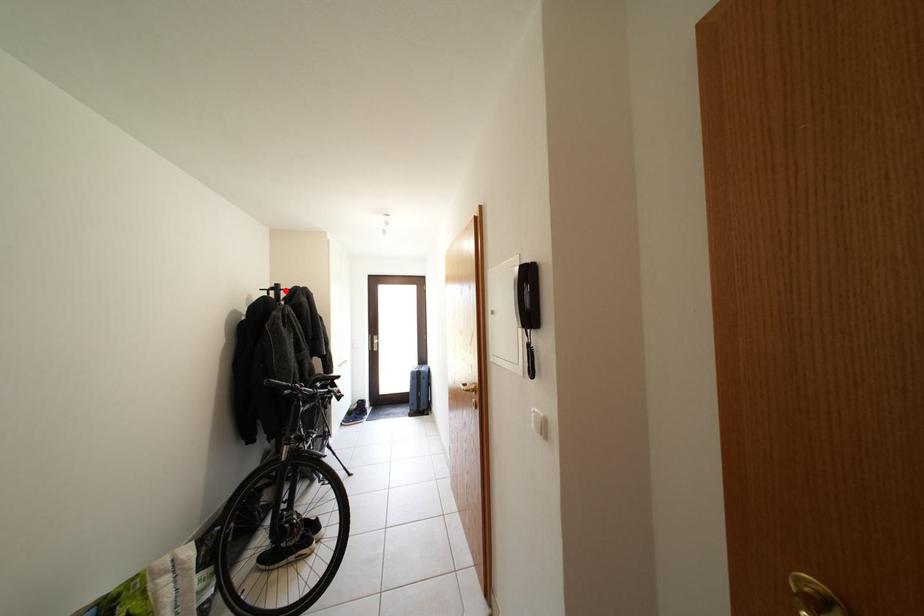
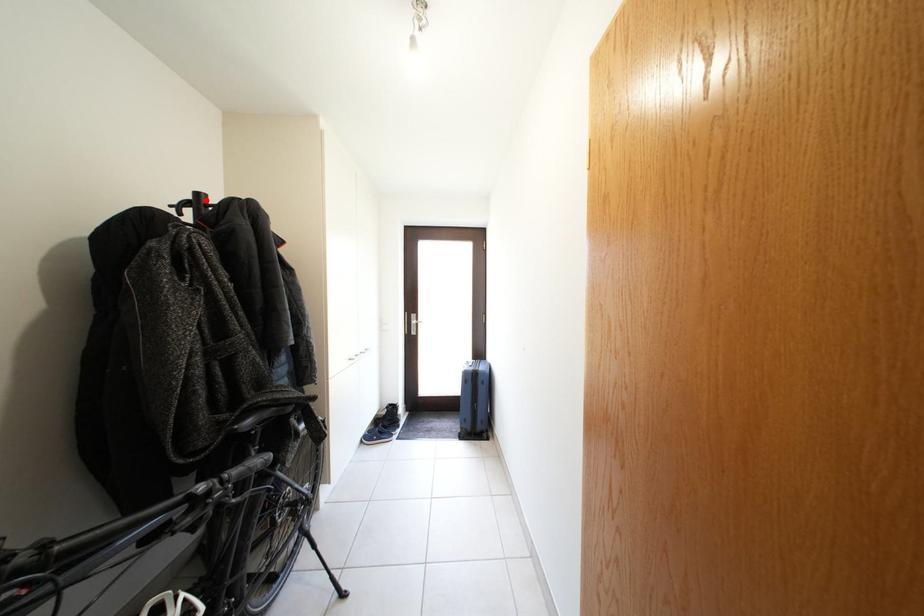
I am providing you with two images of the same scene from different viewpoints. A red point is marked on the first image and another point is marked on the second image. Are the points marked in image1 and image2 representing the same 3D position?

Yes